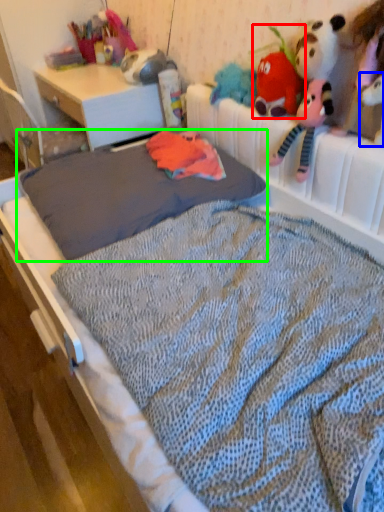
Question: Which is farther away from toy (highlighted by a red box)? toy (highlighted by a blue box) or mattress (highlighted by a green box)?

Choices:
 (A) toy
 (B) mattress

Answer: (B)